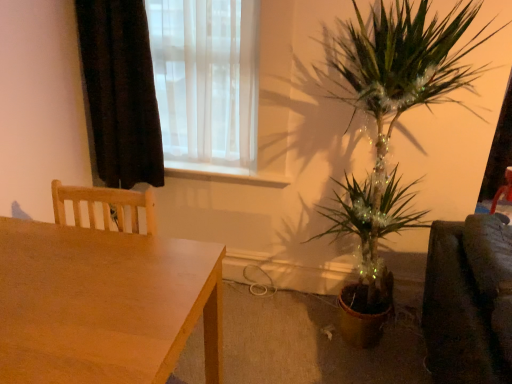
Question: From a real-world perspective, is wooden table at lower left under white glossy window sill at center?

Choices:
 (A) no
 (B) yes

Answer: (B)

Question: Could you tell me if wooden table at lower left is facing white glossy window sill at center?

Choices:
 (A) yes
 (B) no

Answer: (B)

Question: From the image's perspective, does wooden table at lower left appear lower than white glossy window sill at center?

Choices:
 (A) no
 (B) yes

Answer: (B)

Question: Is white glossy window sill at center at the back of wooden table at lower left?

Choices:
 (A) yes
 (B) no

Answer: (B)

Question: Is wooden table at lower left to the left of white glossy window sill at center from the viewer's perspective?

Choices:
 (A) no
 (B) yes

Answer: (B)

Question: Considering the positions of translucent white curtain at upper left and wooden table at lower left in the image, is translucent white curtain at upper left taller or shorter than wooden table at lower left?

Choices:
 (A) short
 (B) tall

Answer: (B)

Question: From a real-world perspective, is translucent white curtain at upper left physically located above or below wooden table at lower left?

Choices:
 (A) below
 (B) above

Answer: (B)

Question: Do you think translucent white curtain at upper left is within wooden table at lower left, or outside of it?

Choices:
 (A) outside
 (B) inside

Answer: (A)

Question: From the image's perspective, is translucent white curtain at upper left located above or below wooden table at lower left?

Choices:
 (A) below
 (B) above

Answer: (B)

Question: From their relative heights in the image, would you say white glossy window sill at center is taller or shorter than translucent white curtain at upper left?

Choices:
 (A) short
 (B) tall

Answer: (A)

Question: From a real-world perspective, is white glossy window sill at center above or below translucent white curtain at upper left?

Choices:
 (A) below
 (B) above

Answer: (A)

Question: Does point (173, 162) appear closer or farther from the camera than point (202, 81)?

Choices:
 (A) closer
 (B) farther

Answer: (B)

Question: From the image's perspective, is white glossy window sill at center located above or below translucent white curtain at upper left?

Choices:
 (A) above
 (B) below

Answer: (B)

Question: Considering the positions of black velvet curtain at upper left and translucent white curtain at upper left in the image, is black velvet curtain at upper left wider or thinner than translucent white curtain at upper left?

Choices:
 (A) thin
 (B) wide

Answer: (B)

Question: In the image, is black velvet curtain at upper left positioned in front of or behind translucent white curtain at upper left?

Choices:
 (A) front
 (B) behind

Answer: (A)